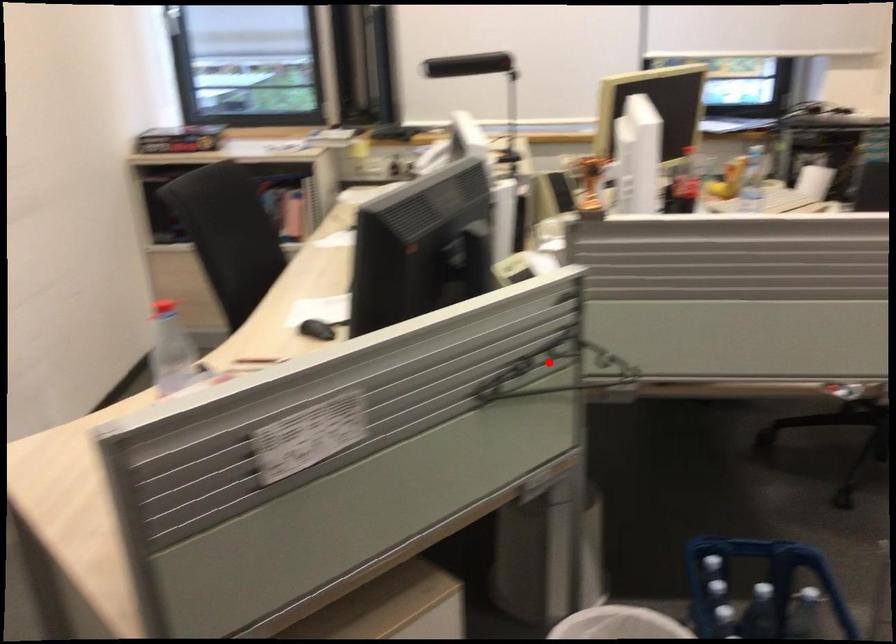
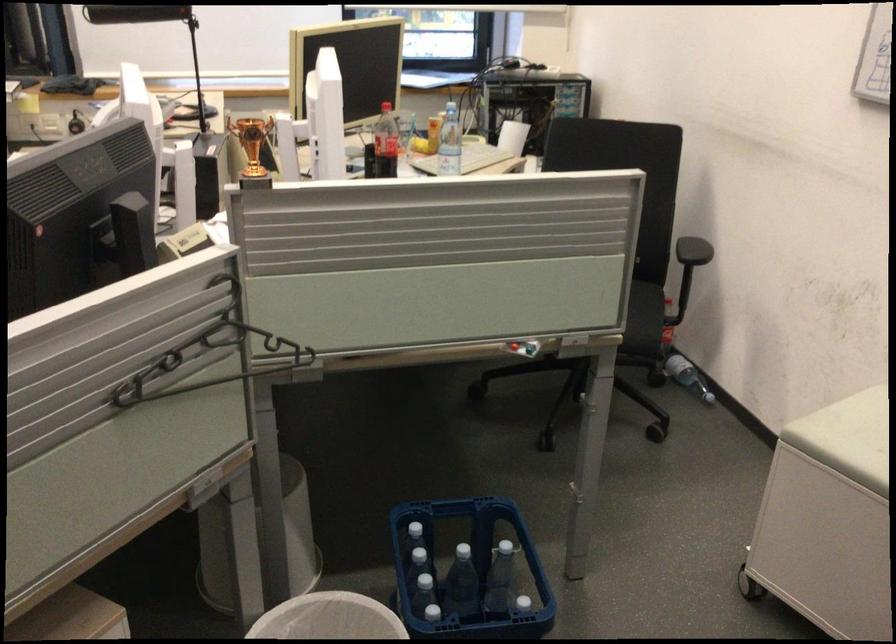
Question: I am providing you with two images of the same scene from different viewpoints. A red point is shown in image1. For the corresponding object point in image2, is it positioned nearer or farther from the camera?

Choices:
 (A) Nearer
 (B) Farther

Answer: (A)